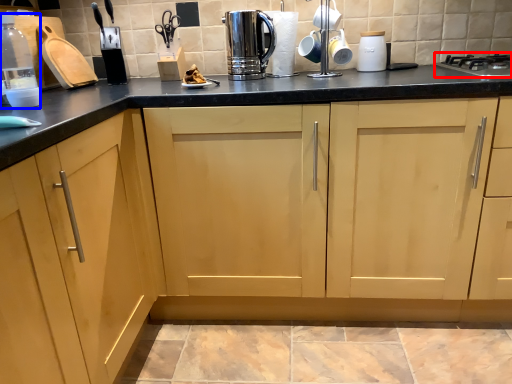
Question: Which point is further to the camera, home appliance (highlighted by a red box) or bottle (highlighted by a blue box)?

Choices:
 (A) home appliance
 (B) bottle

Answer: (A)